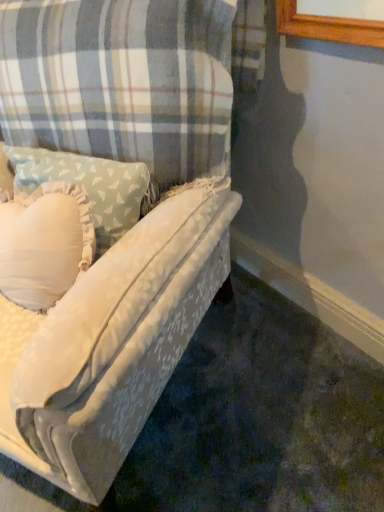
Question: Is the depth of white soft pillow at center greater than that of velvet-like fabric couch at center?

Choices:
 (A) yes
 (B) no

Answer: (A)

Question: From a real-world perspective, is white soft pillow at center over velvet-like fabric couch at center?

Choices:
 (A) yes
 (B) no

Answer: (A)

Question: Can you confirm if white soft pillow at center is smaller than velvet-like fabric couch at center?

Choices:
 (A) no
 (B) yes

Answer: (B)

Question: Does white soft pillow at center appear on the left side of velvet-like fabric couch at center?

Choices:
 (A) yes
 (B) no

Answer: (B)

Question: Is white soft pillow at center facing towards velvet-like fabric couch at center?

Choices:
 (A) yes
 (B) no

Answer: (A)

Question: Is white soft pillow at center in contact with velvet-like fabric couch at center?

Choices:
 (A) no
 (B) yes

Answer: (A)

Question: Is velvet-like fabric couch at center to the left of white soft pillow at center from the viewer's perspective?

Choices:
 (A) yes
 (B) no

Answer: (A)

Question: Would you say white soft pillow at center is part of velvet-like fabric couch at center's contents?

Choices:
 (A) no
 (B) yes

Answer: (B)

Question: Considering the relative sizes of velvet-like fabric couch at center and white soft pillow at center in the image provided, is velvet-like fabric couch at center taller than white soft pillow at center?

Choices:
 (A) yes
 (B) no

Answer: (A)

Question: Is the depth of velvet-like fabric couch at center less than that of white soft pillow at center?

Choices:
 (A) yes
 (B) no

Answer: (A)

Question: Does velvet-like fabric couch at center have a larger size compared to white soft pillow at center?

Choices:
 (A) yes
 (B) no

Answer: (A)

Question: Is velvet-like fabric couch at center smaller than white soft pillow at center?

Choices:
 (A) yes
 (B) no

Answer: (B)

Question: Considering the relative positions of velvet-like fabric couch at center and white soft pillow at center in the image provided, is velvet-like fabric couch at center to the left or to the right of white soft pillow at center?

Choices:
 (A) left
 (B) right

Answer: (A)